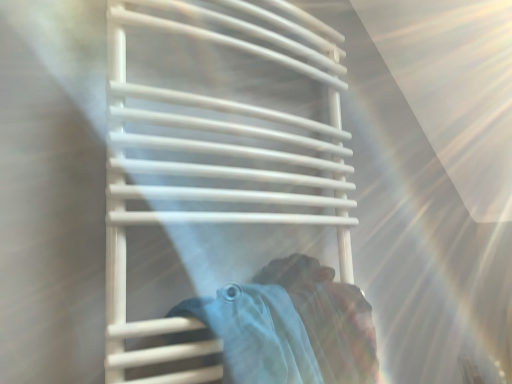
Question: Does light blue fabric at center turn towards white plastic towel rack at center?

Choices:
 (A) yes
 (B) no

Answer: (A)

Question: Can you confirm if light blue fabric at center is thinner than white plastic towel rack at center?

Choices:
 (A) yes
 (B) no

Answer: (A)

Question: Considering the relative positions of light blue fabric at center and white plastic towel rack at center in the image provided, is light blue fabric at center to the right of white plastic towel rack at center from the viewer's perspective?

Choices:
 (A) yes
 (B) no

Answer: (B)

Question: From the image's perspective, does light blue fabric at center appear higher than white plastic towel rack at center?

Choices:
 (A) yes
 (B) no

Answer: (B)

Question: From a real-world perspective, is light blue fabric at center positioned over white plastic towel rack at center based on gravity?

Choices:
 (A) no
 (B) yes

Answer: (A)

Question: Considering the relative positions of light blue fabric at center and white plastic towel rack at center in the image provided, is light blue fabric at center in front of white plastic towel rack at center?

Choices:
 (A) no
 (B) yes

Answer: (A)

Question: Is white plastic towel rack at center to the left of light blue fabric at center from the viewer's perspective?

Choices:
 (A) no
 (B) yes

Answer: (A)

Question: Can you confirm if white plastic towel rack at center is shorter than light blue fabric at center?

Choices:
 (A) no
 (B) yes

Answer: (A)

Question: Is white plastic towel rack at center wider than light blue fabric at center?

Choices:
 (A) no
 (B) yes

Answer: (B)

Question: From a real-world perspective, is white plastic towel rack at center physically below light blue fabric at center?

Choices:
 (A) no
 (B) yes

Answer: (A)

Question: Is light blue fabric at center inside white plastic towel rack at center?

Choices:
 (A) no
 (B) yes

Answer: (B)

Question: Is white plastic towel rack at center oriented towards light blue fabric at center?

Choices:
 (A) no
 (B) yes

Answer: (B)

Question: From the image's perspective, is white plastic towel rack at center above or below light blue fabric at center?

Choices:
 (A) below
 (B) above

Answer: (B)